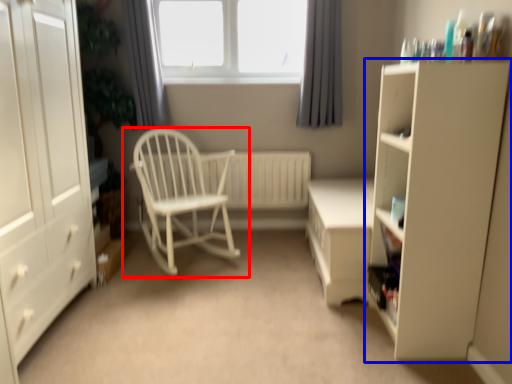
Question: Which object is further to the camera taking this photo, chair (highlighted by a red box) or cupboard (highlighted by a blue box)?

Choices:
 (A) chair
 (B) cupboard

Answer: (A)